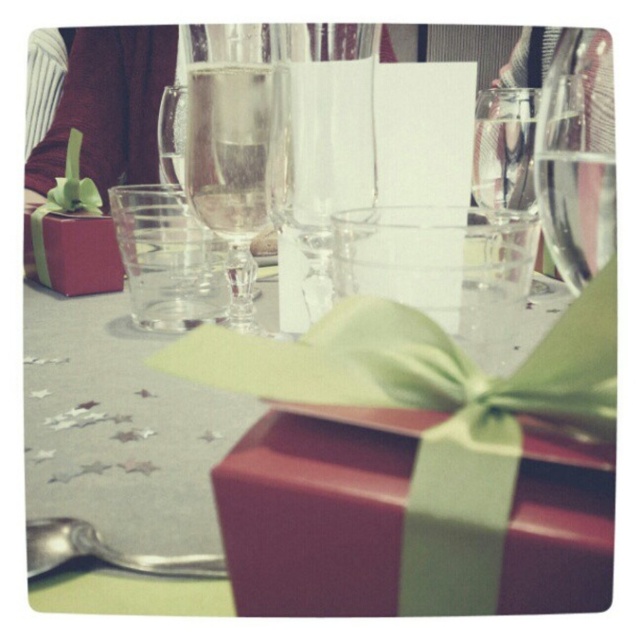
Between matte red gift at lower center and transparent glass wine glass at upper center, which one appears on the left side from the viewer's perspective?

matte red gift at lower center is more to the left.

Which is in front, point (515, 458) or point (612, 112)?

Point (515, 458) is more forward.

Identify the location of matte red gift at lower center. The width and height of the screenshot is (640, 640). (308, 477).

Does transparent glass wine glass at upper center appear on the left side of clear glass champagne at center?

No, transparent glass wine glass at upper center is not to the left of clear glass champagne at center.

Is transparent glass wine glass at upper center below clear glass champagne at center?

Yes.

At what (x,y) coordinates should I click in order to perform the action: click on transparent glass wine glass at upper center. Please return your answer as a coordinate pair (x, y). Looking at the image, I should click on (577, 156).

Find the location of a particular element. Image resolution: width=640 pixels, height=640 pixels. transparent glass wine glass at upper center is located at coordinates (577, 156).

Which is behind, point (401, 426) or point (243, 108)?

Point (243, 108)

Is point (326, 433) more distant than point (196, 86)?

No.

In order to click on matte red gift box at lower left in this screenshot , I will do `click(316, 512)`.